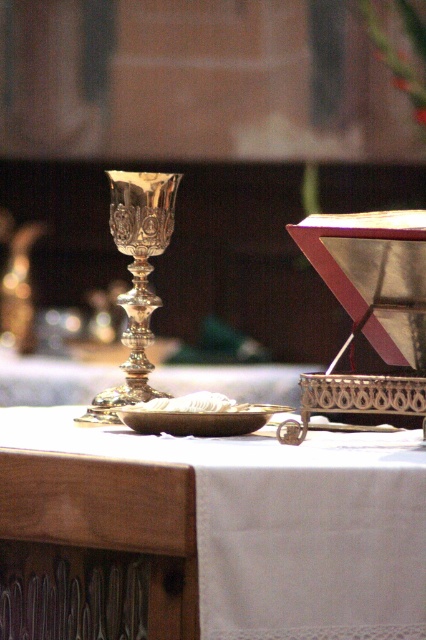
Question: Is white lace cloth at center positioned at the back of polished silver goblet at center?

Choices:
 (A) no
 (B) yes

Answer: (A)

Question: Which object appears farthest from the camera in this image?

Choices:
 (A) matte gold plate at center
 (B) polished silver goblet at center
 (C) white lace cloth at center

Answer: (B)

Question: Is white lace cloth at center smaller than polished silver goblet at center?

Choices:
 (A) no
 (B) yes

Answer: (A)

Question: Which point appears farthest from the camera in this image?

Choices:
 (A) (152, 253)
 (B) (259, 413)
 (C) (106, 445)

Answer: (A)

Question: Is white lace cloth at center wider than matte gold plate at center?

Choices:
 (A) yes
 (B) no

Answer: (A)

Question: Which of these objects is positioned closest to the matte gold plate at center?

Choices:
 (A) white lace cloth at center
 (B) polished silver goblet at center

Answer: (B)